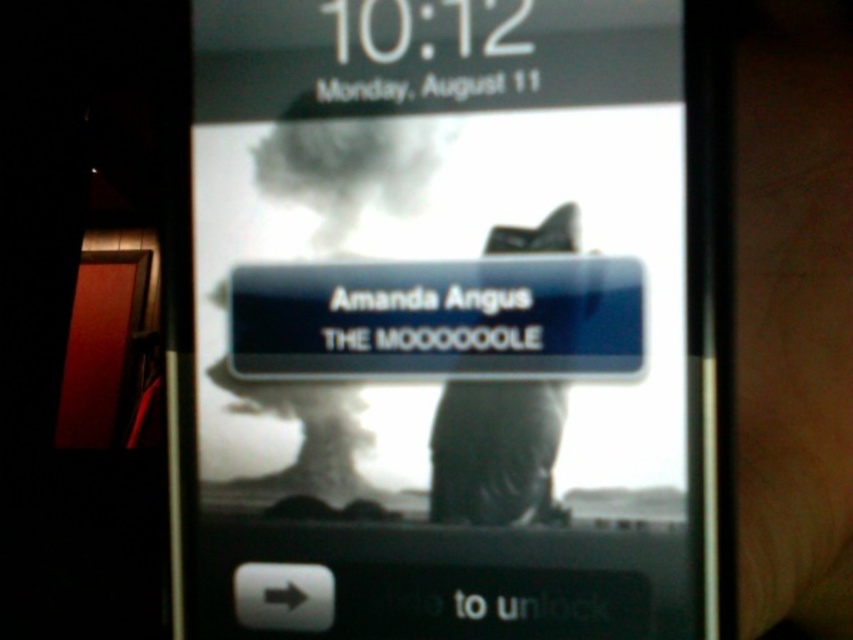
Question: From the image, what is the correct spatial relationship of matte black phone at center in relation to brown leather hand at right?

Choices:
 (A) above
 (B) below

Answer: (A)

Question: Can you confirm if matte black phone at center is positioned to the right of brown leather hand at right?

Choices:
 (A) yes
 (B) no

Answer: (B)

Question: Which point is farther from the camera taking this photo?

Choices:
 (A) (543, 454)
 (B) (740, 40)

Answer: (B)

Question: Which point appears closest to the camera in this image?

Choices:
 (A) (556, 384)
 (B) (743, 456)
 (C) (352, 388)

Answer: (A)

Question: Which of these objects is positioned closest to the dark matte jacket at center?

Choices:
 (A) matte black phone at center
 (B) brown leather hand at right

Answer: (A)

Question: From the image, what is the correct spatial relationship of brown leather hand at right in relation to dark matte jacket at center?

Choices:
 (A) left
 (B) right

Answer: (B)